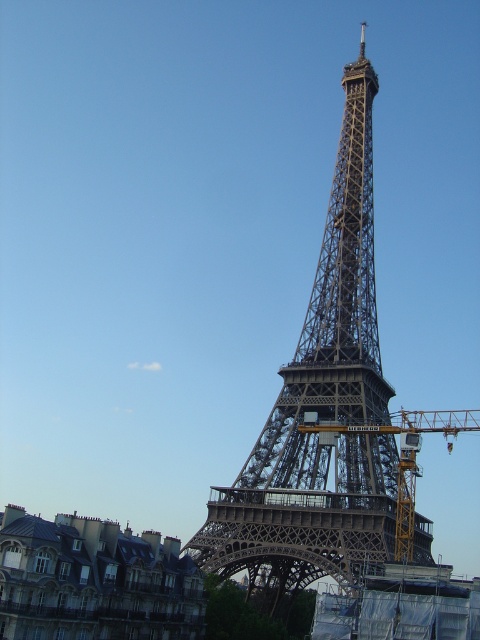
Question: Which point is closer to the camera taking this photo?

Choices:
 (A) (297, 497)
 (B) (412, 472)

Answer: (A)

Question: Observing the image, what is the correct spatial positioning of metallic lattice tower at center in reference to yellow metallic crane at center?

Choices:
 (A) right
 (B) left

Answer: (B)

Question: Among these points, which one is nearest to the camera?

Choices:
 (A) (374, 417)
 (B) (418, 433)

Answer: (B)

Question: Which of the following is the farthest from the observer?

Choices:
 (A) (333, 428)
 (B) (368, 268)

Answer: (B)

Question: From the image, what is the correct spatial relationship of metallic lattice tower at center in relation to yellow metallic crane at center?

Choices:
 (A) above
 (B) below

Answer: (A)

Question: Does metallic lattice tower at center appear on the left side of yellow metallic crane at center?

Choices:
 (A) yes
 (B) no

Answer: (A)